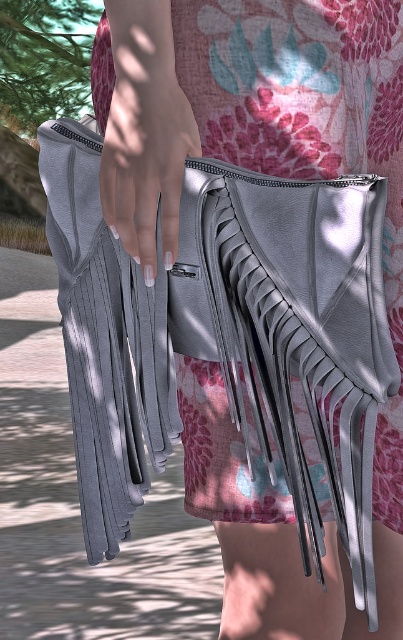
You are a fashion designer trying to place a white matte nail at center on top of the matte gray leather dress at center. Will the nail fit entirely on the dress?

The matte gray leather dress at center might be wider than white matte nail at center, so there is a possibility that the nail could fit, but it depends on their exact dimensions.

You are a fashion designer working on a new collection. You want to ensure that the matte gray leather dress at center and the white matte nail at center are positioned in a way that they complement each other visually. Given their current distance, can you place them closer together without overlapping?

The matte gray leather dress at center is 5.38 inches from the white matte nail at center. Since they are not overlapping and there is space between them, you can move them closer together while maintaining their distinct positions.

You are a fashion designer observing the image. You need to decide the order of the items from top to bottom. Which item is positioned above the other between the matte gray leather dress at center and the white matte nail at center?

The white matte nail at center is positioned above the matte gray leather dress at center because the description states that the dress is located below the nail.